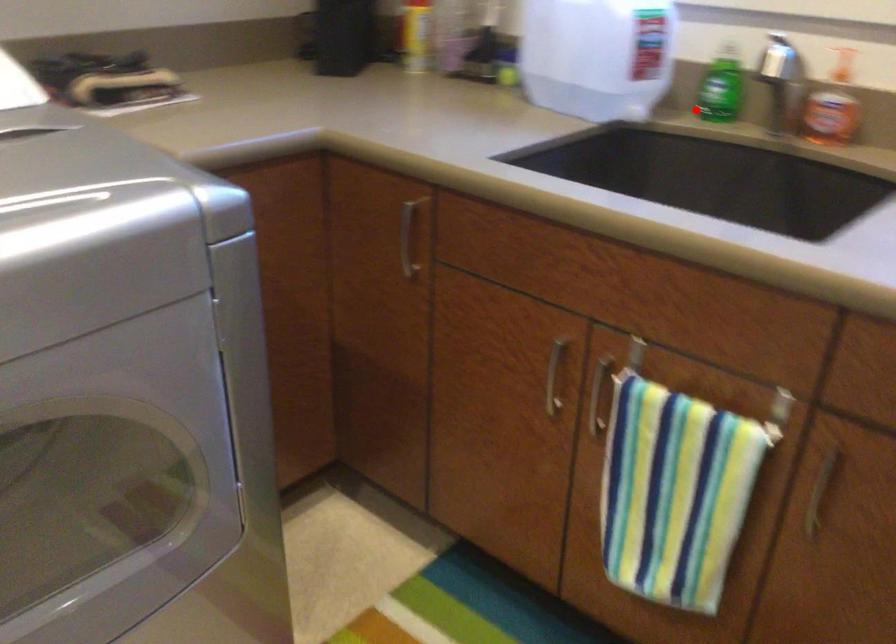
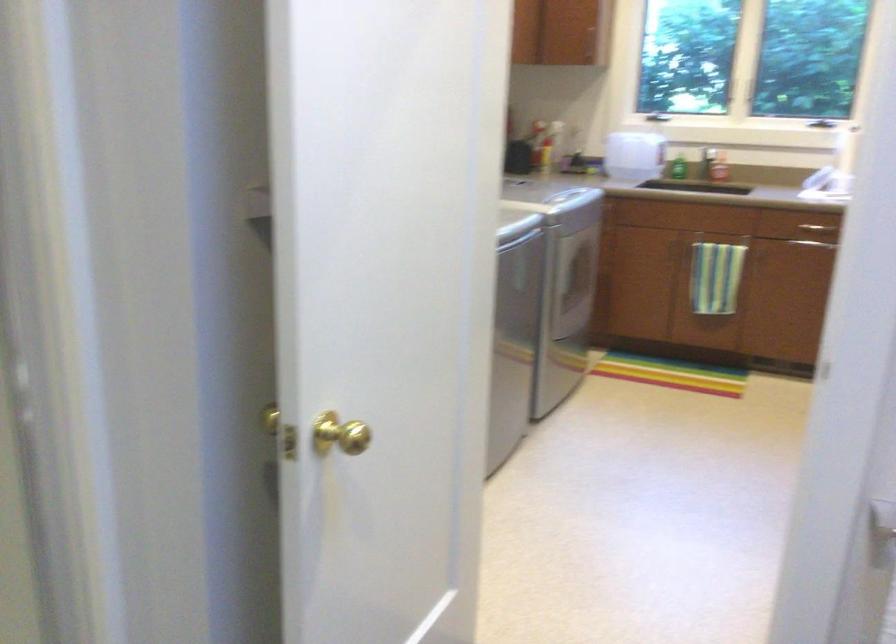
Locate, in the second image, the point that corresponds to the highlighted location in the first image.

(676, 167)